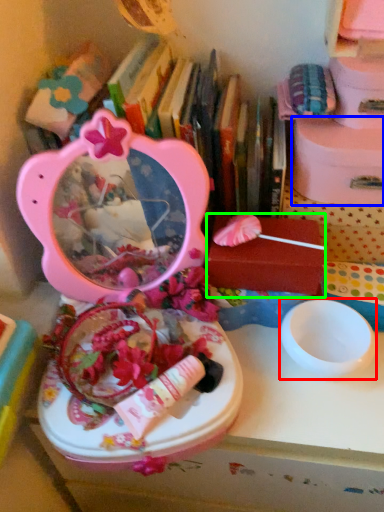
Question: Considering the real-world distances, which object is closest to bowl (highlighted by a red box)? storage box (highlighted by a blue box) or storage box (highlighted by a green box).

Choices:
 (A) storage box
 (B) storage box

Answer: (B)